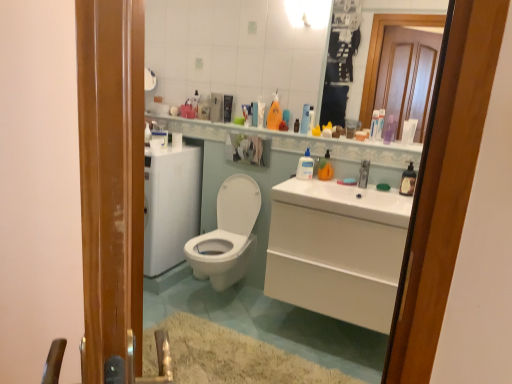
Identify the location of free space in front of orange matte bottle at upper center, the third cleaning product in the left-to-right sequence. (328, 183).